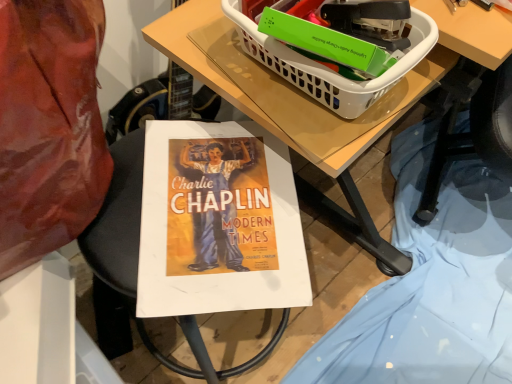
Question: Is white plastic basket at upper right positioned far away from wooden table at center?

Choices:
 (A) no
 (B) yes

Answer: (A)

Question: Can you confirm if white plastic basket at upper right is shorter than wooden table at center?

Choices:
 (A) no
 (B) yes

Answer: (A)

Question: Is white plastic basket at upper right positioned with its back to wooden table at center?

Choices:
 (A) no
 (B) yes

Answer: (A)

Question: From the image's perspective, is white plastic basket at upper right on wooden table at center?

Choices:
 (A) no
 (B) yes

Answer: (B)

Question: From a real-world perspective, is white plastic basket at upper right physically above wooden table at center?

Choices:
 (A) no
 (B) yes

Answer: (B)

Question: Is white plastic basket at upper right wider than wooden table at center?

Choices:
 (A) yes
 (B) no

Answer: (B)

Question: From the image's perspective, is wooden table at center on white plastic basket at upper right?

Choices:
 (A) no
 (B) yes

Answer: (A)

Question: From a real-world perspective, does wooden table at center sit lower than white plastic basket at upper right?

Choices:
 (A) yes
 (B) no

Answer: (A)

Question: Can you confirm if wooden table at center is thinner than white plastic basket at upper right?

Choices:
 (A) no
 (B) yes

Answer: (A)

Question: Could you tell me if wooden table at center is turned towards white plastic basket at upper right?

Choices:
 (A) no
 (B) yes

Answer: (A)

Question: Is wooden table at center not within white plastic basket at upper right?

Choices:
 (A) no
 (B) yes

Answer: (B)

Question: From a real-world perspective, is wooden table at center on white plastic basket at upper right?

Choices:
 (A) no
 (B) yes

Answer: (A)

Question: Is point (307, 77) positioned closer to the camera than point (199, 44)?

Choices:
 (A) farther
 (B) closer

Answer: (B)